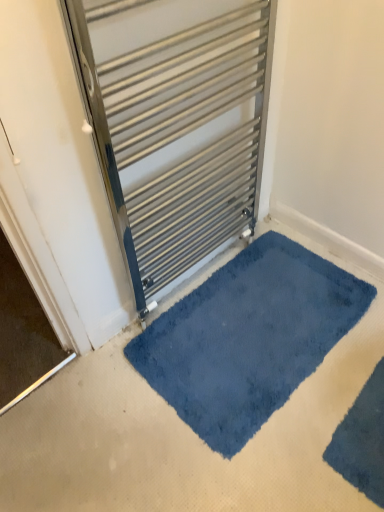
Find the location of a particular element. This screenshot has width=384, height=512. vacant region below metallic silver radiator at center (from a real-world perspective) is located at coordinates (193, 280).